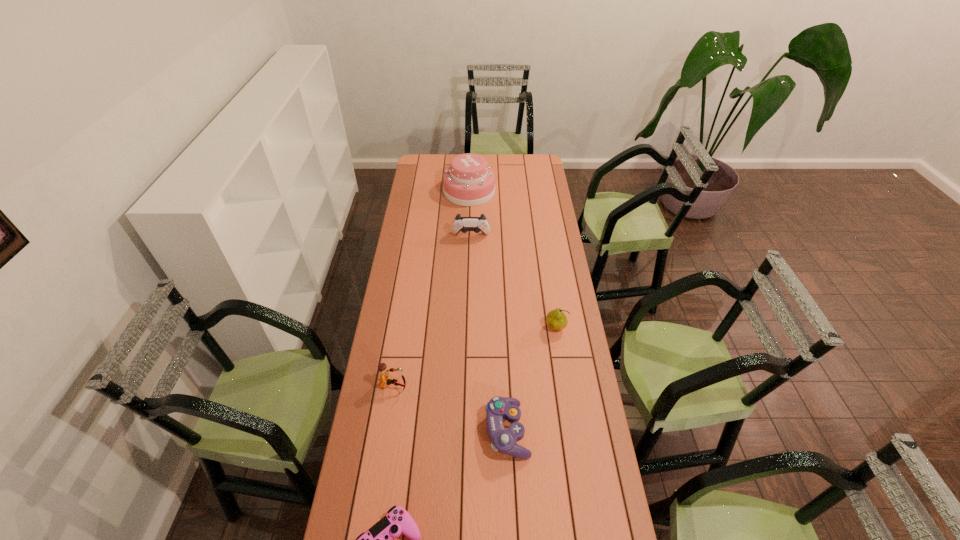
Where is `cake`? This screenshot has width=960, height=540. cake is located at coordinates (469, 181).

This screenshot has width=960, height=540. I want to click on the tallest object, so click(469, 181).

This screenshot has width=960, height=540. I want to click on the fifth nearest object, so click(x=463, y=224).

This screenshot has height=540, width=960. What are the coordinates of `the farthest control` in the screenshot? It's located at (463, 224).

This screenshot has height=540, width=960. What are the coordinates of `the rightmost object` in the screenshot? It's located at (556, 319).

I want to click on the third farthest object, so click(556, 319).

At what (x,y) coordinates should I click in order to perform the action: click on Lego. Please return your answer as a coordinate pair (x, y). The image size is (960, 540). Looking at the image, I should click on (385, 378).

Locate an element on the screen. the second nearest object is located at coordinates (498, 408).

Image resolution: width=960 pixels, height=540 pixels. Identify the location of the fifth tallest object. (498, 408).

This screenshot has height=540, width=960. Identify the location of free spot located on the front of the cake. (468, 255).